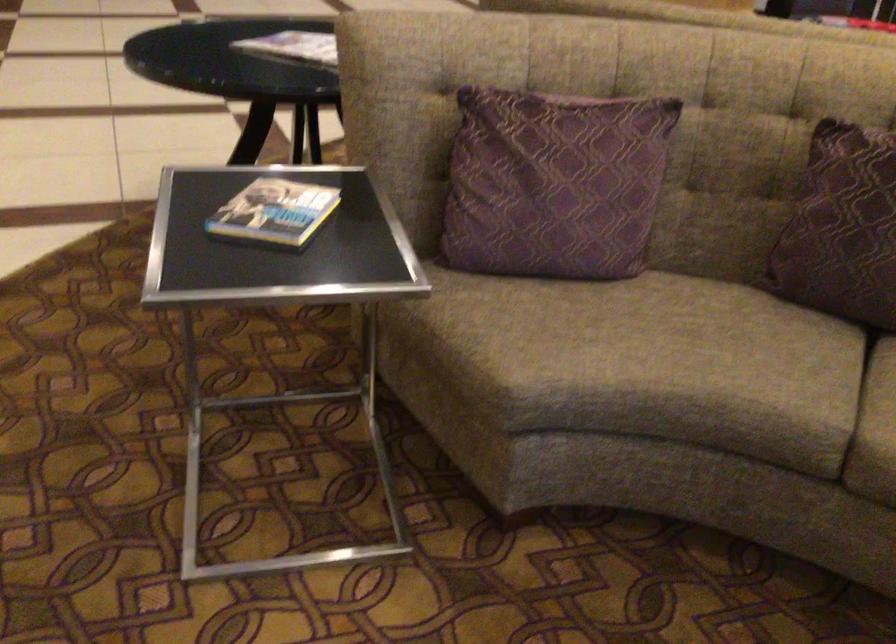
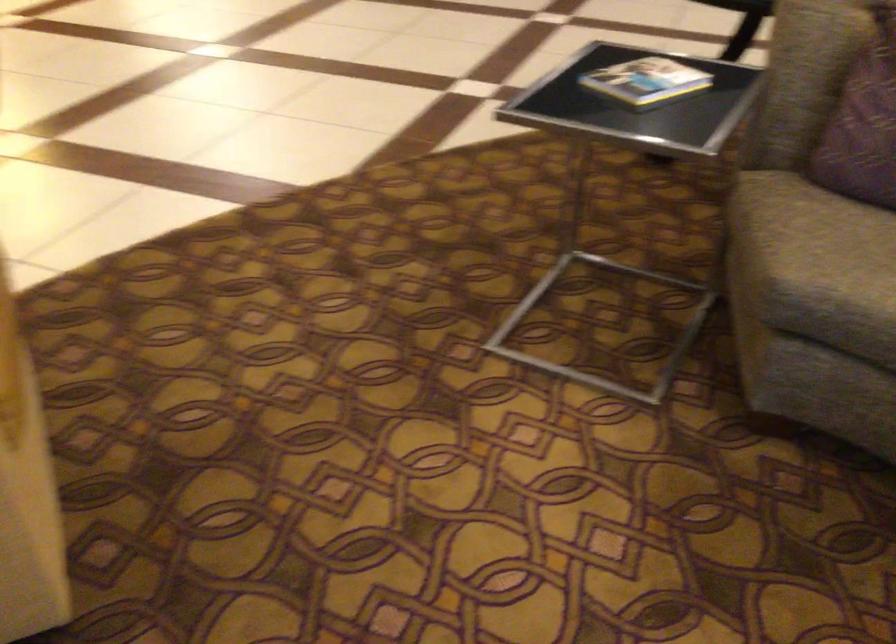
Find the pixel in the second image that matches pixel 293 209 in the first image.

(645, 80)